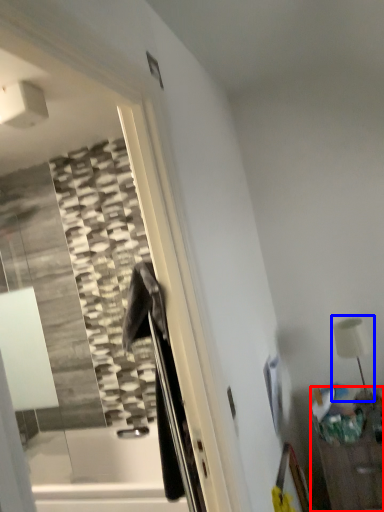
Question: Which of the following is the farthest to the observer, furniture (highlighted by a red box) or table lamp (highlighted by a blue box)?

Choices:
 (A) furniture
 (B) table lamp

Answer: (B)